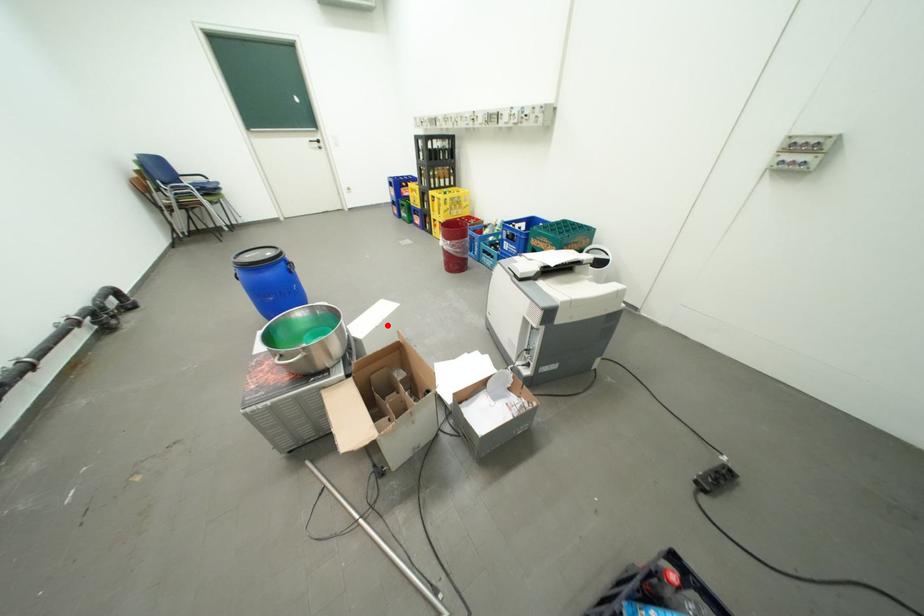
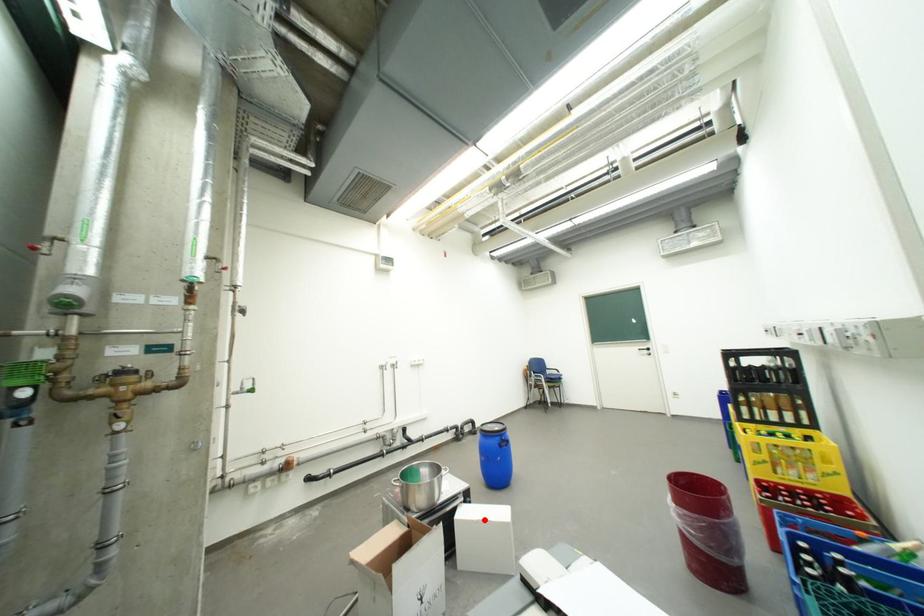
I am providing you with two images of the same scene from different viewpoints. A red point is marked on the first image and another point is marked on the second image. Do the highlighted points in image1 and image2 indicate the same real-world spot?

Yes